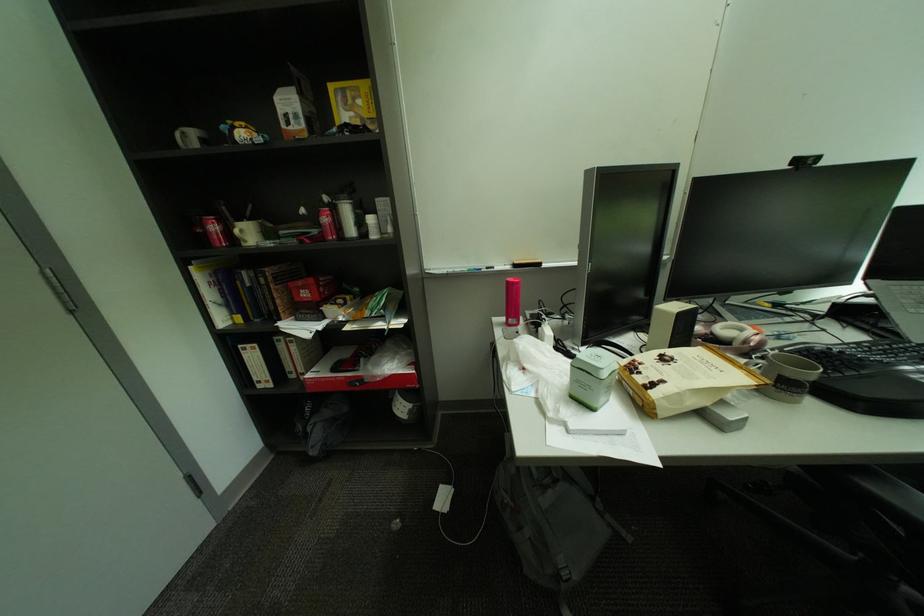
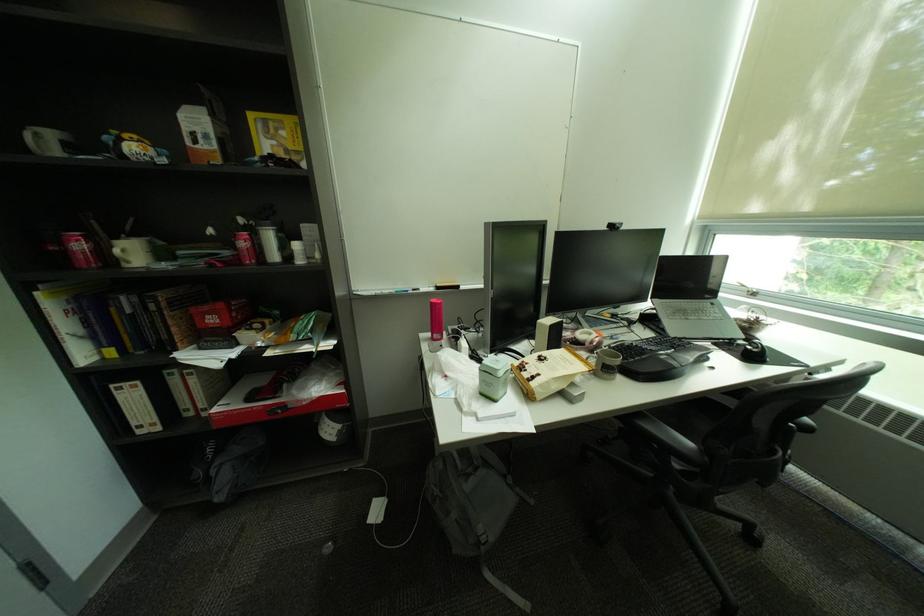
Where in the second image is the point corresponding to (517,493) from the first image?

(446, 487)